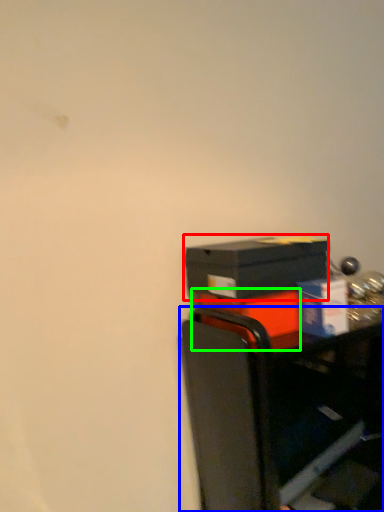
Question: Estimate the real-world distances between objects in this image. Which object is farther from box (highlighted by a red box), furniture (highlighted by a blue box) or box (highlighted by a green box)?

Choices:
 (A) furniture
 (B) box

Answer: (A)